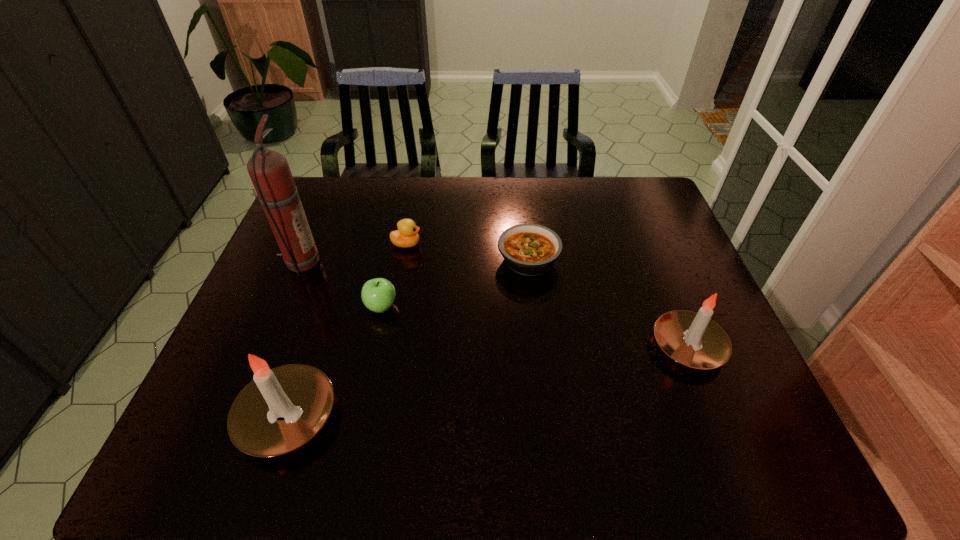
This screenshot has height=540, width=960. What are the coordinates of `free point that satisfies the following two spatial constraints: 1. on the side of the fire extinguisher with the label and nozzle; 2. on the right side of the rightmost object` in the screenshot? It's located at (266, 346).

At what (x,y) coordinates should I click in order to perform the action: click on vacant space that satisfies the following two spatial constraints: 1. on the side of the fire extinguisher with the label and nozzle; 2. on the left side of the fifth shortest object. Please return your answer as a coordinate pair (x, y). The image size is (960, 540). Looking at the image, I should click on (236, 416).

Locate an element on the screen. vacant position in the image that satisfies the following two spatial constraints: 1. on the front side of the second object from right to left; 2. on the side of the fire extinguisher with the label and nozzle is located at coordinates (529, 263).